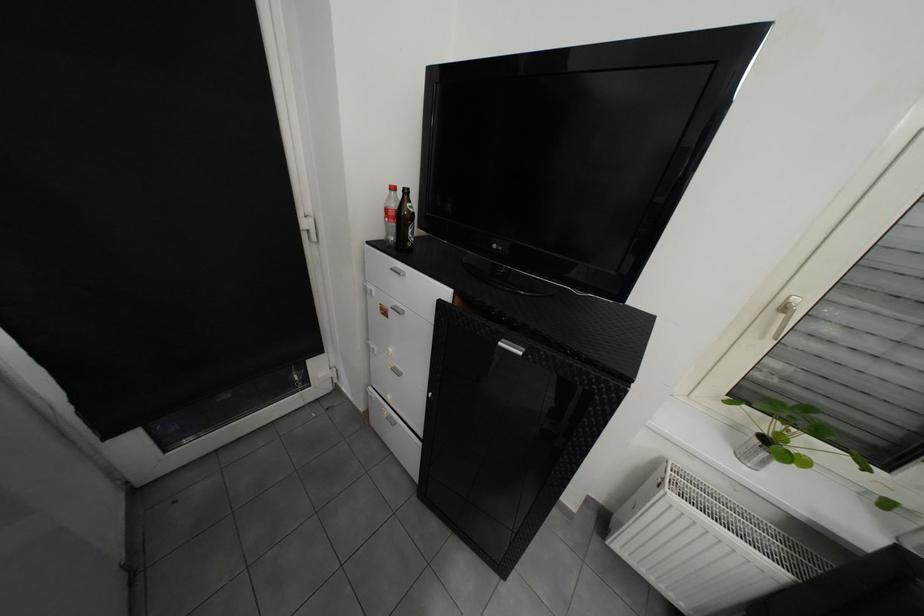
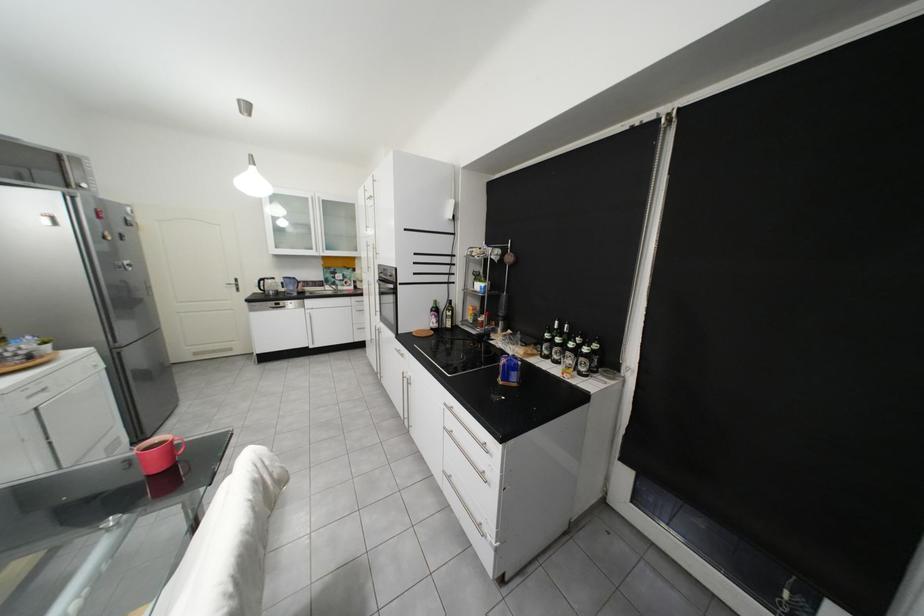
Question: How did the camera likely rotate?

Choices:
 (A) Left
 (B) Right
 (C) Up
 (D) Down

Answer: (A)